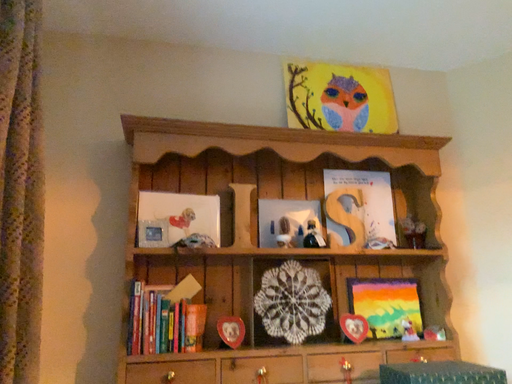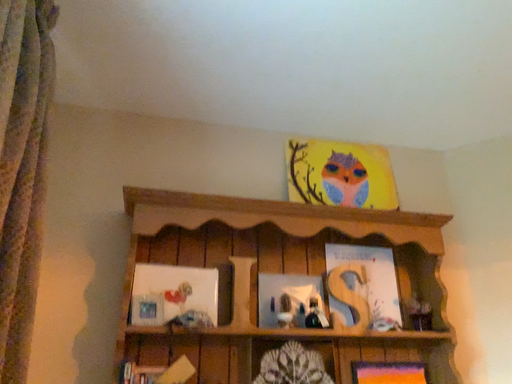
Question: How did the camera likely rotate when shooting the video?

Choices:
 (A) rotated upward
 (B) rotated downward

Answer: (A)